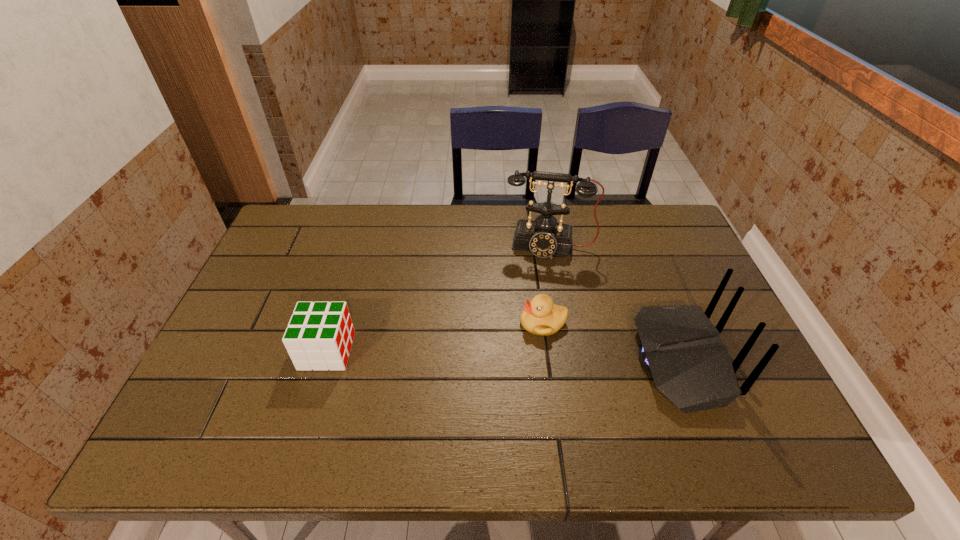
Identify the location of vacant position located 0.320m on the dial of the tallest object. (535, 342).

Where is `vacant space located 0.180m on the front-facing side of the shortest object`? vacant space located 0.180m on the front-facing side of the shortest object is located at coordinates (464, 361).

Where is `free space located 0.280m on the front-facing side of the shortest object`? The width and height of the screenshot is (960, 540). free space located 0.280m on the front-facing side of the shortest object is located at coordinates (427, 378).

Where is `free location located on the front-facing side of the shortest object`? The image size is (960, 540). free location located on the front-facing side of the shortest object is located at coordinates (399, 391).

Find the location of a particular element. This screenshot has width=960, height=540. object present at the far edge is located at coordinates (543, 236).

This screenshot has width=960, height=540. In order to click on object present at the near edge in this screenshot , I will do (x=681, y=348).

At what (x,y) coordinates should I click in order to perform the action: click on object present at the right edge. Please return your answer as a coordinate pair (x, y). This screenshot has height=540, width=960. Looking at the image, I should click on (681, 348).

Where is `object situated at the near right corner`? The image size is (960, 540). object situated at the near right corner is located at coordinates (681, 348).

You are a GUI agent. You are given a task and a screenshot of the screen. Output one action in this format:
    pyautogui.click(x=<x>, y=<y>)
    Task: Click on the free point at the far edge
    The width and height of the screenshot is (960, 540).
    Given the screenshot: What is the action you would take?
    pyautogui.click(x=357, y=238)

I want to click on free region at the near edge, so point(304,413).